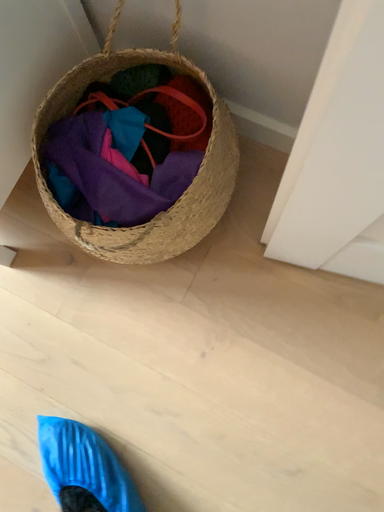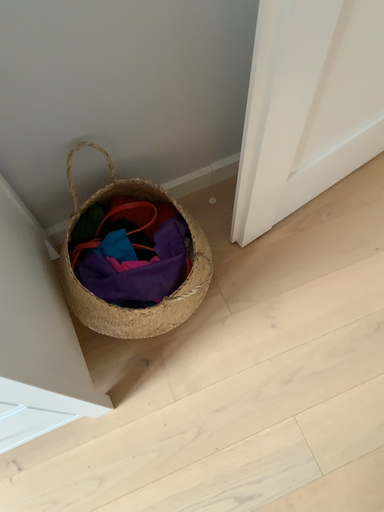
Question: Which way did the camera rotate in the video?

Choices:
 (A) rotated upward
 (B) rotated downward

Answer: (A)